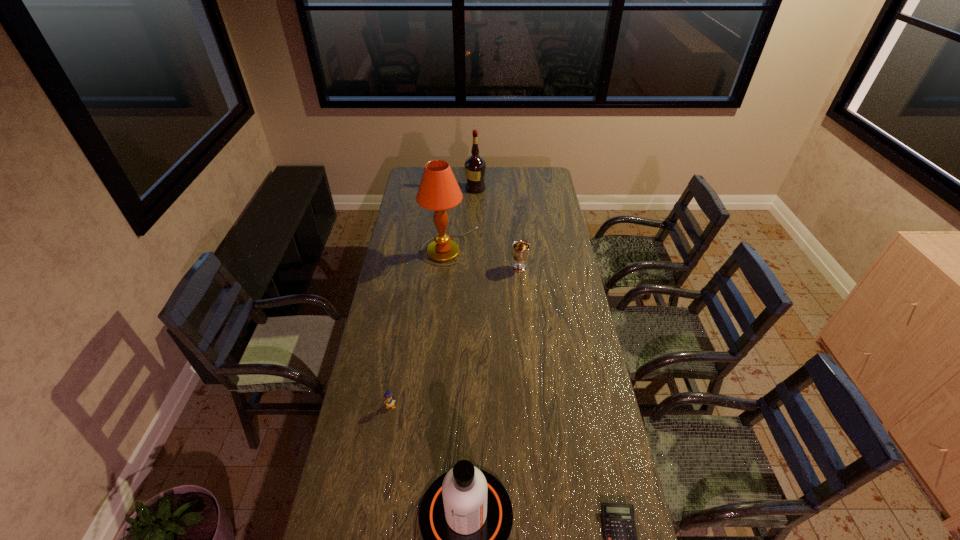
Where is `the tallest object`? the tallest object is located at coordinates pos(438,190).

Locate an element on the screen. The image size is (960, 540). alcohol is located at coordinates (475, 166).

Where is `the farthest object`? the farthest object is located at coordinates (475, 166).

Locate an element on the screen. This screenshot has height=540, width=960. the fifth object from left to right is located at coordinates (520, 252).

Locate an element on the screen. This screenshot has height=540, width=960. chalice is located at coordinates (520, 252).

The image size is (960, 540). I want to click on the leftmost object, so click(389, 401).

Locate an element on the screen. duckling is located at coordinates (389, 401).

Find the location of a particular element. Image resolution: width=960 pixels, height=540 pixels. vacant space located 0.210m on the back of the tallest object is located at coordinates [x=453, y=205].

The height and width of the screenshot is (540, 960). What are the coordinates of `free region located on the label of the fifth shortest object` in the screenshot? It's located at (513, 188).

The width and height of the screenshot is (960, 540). What are the coordinates of `vacant area situated on the right of the chalice` in the screenshot? It's located at (553, 268).